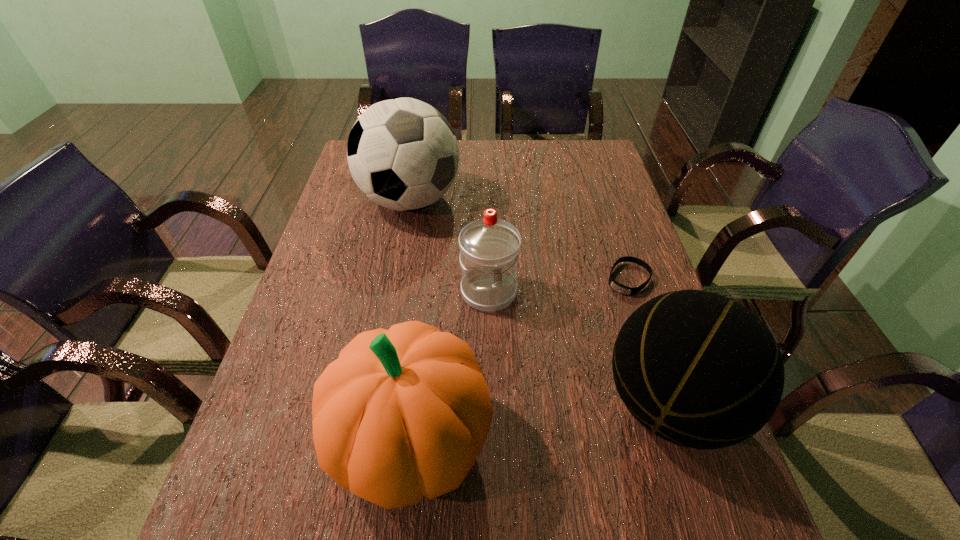
You are a GUI agent. You are given a task and a screenshot of the screen. Output one action in this format:
    pyautogui.click(x=<x>, y=<y>)
    Task: Click on the object that is the second closest to the pumpkin
    
    Given the screenshot: What is the action you would take?
    pyautogui.click(x=701, y=371)

Identify the location of free location that satisfies the following two spatial constraints: 1. on the back side of the basketball; 2. on the right side of the shortest object. The height and width of the screenshot is (540, 960). (629, 279).

This screenshot has width=960, height=540. In order to click on free region that satisfies the following two spatial constraints: 1. on the back side of the water bottle; 2. on the right side of the pumpkin in this screenshot , I will do [428, 292].

Locate an element on the screen. The width and height of the screenshot is (960, 540). vacant space that satisfies the following two spatial constraints: 1. on the front side of the pumpkin; 2. on the right side of the farthest object is located at coordinates (367, 440).